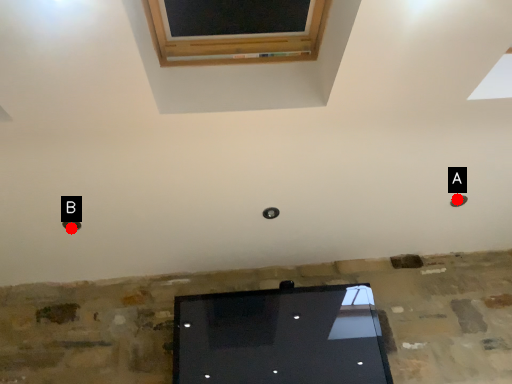
Question: Two points are circled on the image, labeled by A and B beside each circle. Among these points, which one is farthest from the camera?

Choices:
 (A) A is further
 (B) B is further

Answer: (A)